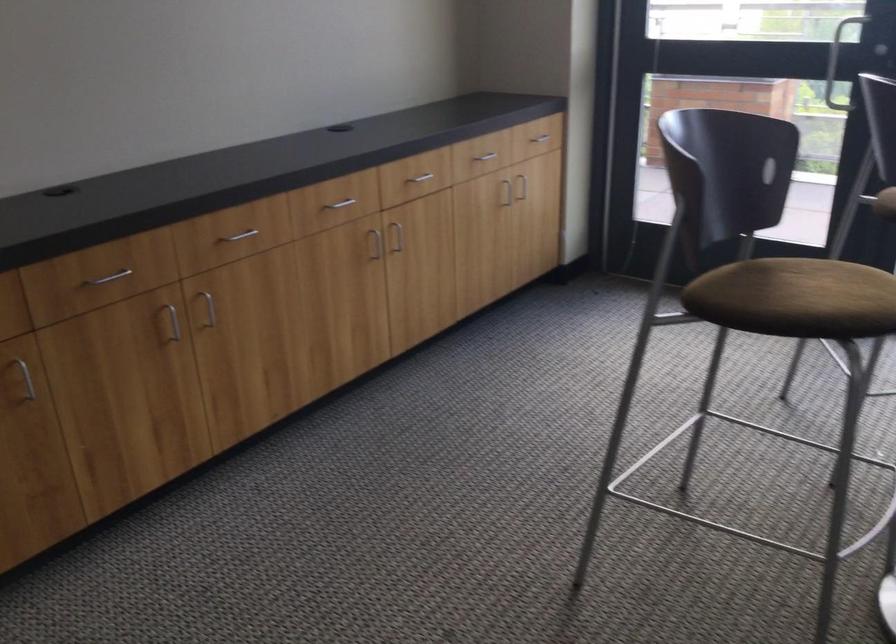
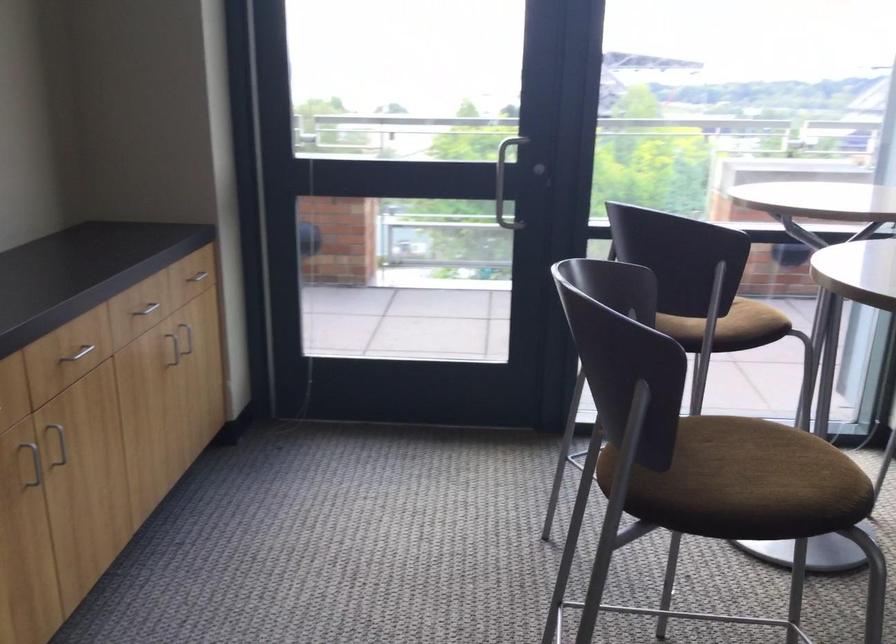
Question: How did the camera likely rotate?

Choices:
 (A) Left
 (B) Right
 (C) Up
 (D) Down

Answer: (B)